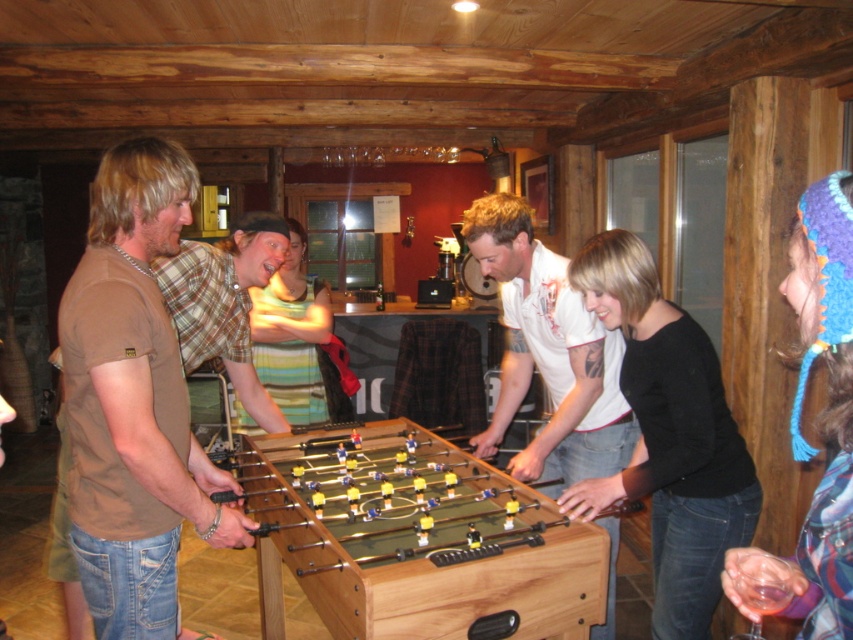
Is point (567, 557) positioned behind point (547, 481)?

That is False.

Is point (262, 497) less distant than point (572, 308)?

No, (262, 497) is further to viewer.

The height and width of the screenshot is (640, 853). Identify the location of wooden foosball table at center. (415, 540).

Can you confirm if white matte shirt at center is wider than blue knitted hat at upper right?

Correct, the width of white matte shirt at center exceeds that of blue knitted hat at upper right.

Is white matte shirt at center shorter than blue knitted hat at upper right?

No, white matte shirt at center is not shorter than blue knitted hat at upper right.

Is point (521, 394) farther from viewer compared to point (726, 588)?

Yes.

This screenshot has width=853, height=640. In order to click on white matte shirt at center in this screenshot , I will do `click(549, 355)`.

Between point (169, 230) and point (819, 532), which one is positioned behind?

Point (169, 230)

This screenshot has height=640, width=853. I want to click on brown cotton t-shirt at left, so pyautogui.click(x=132, y=401).